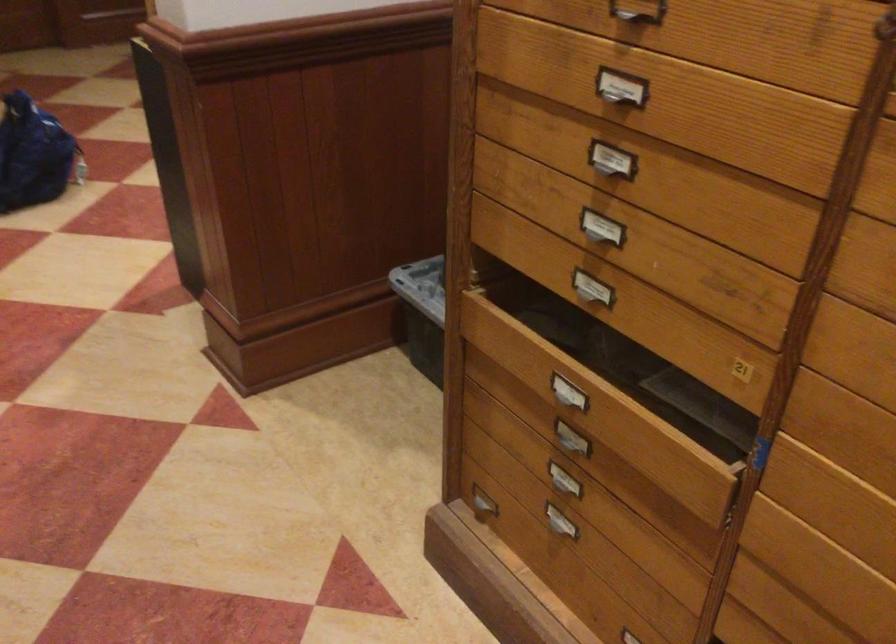
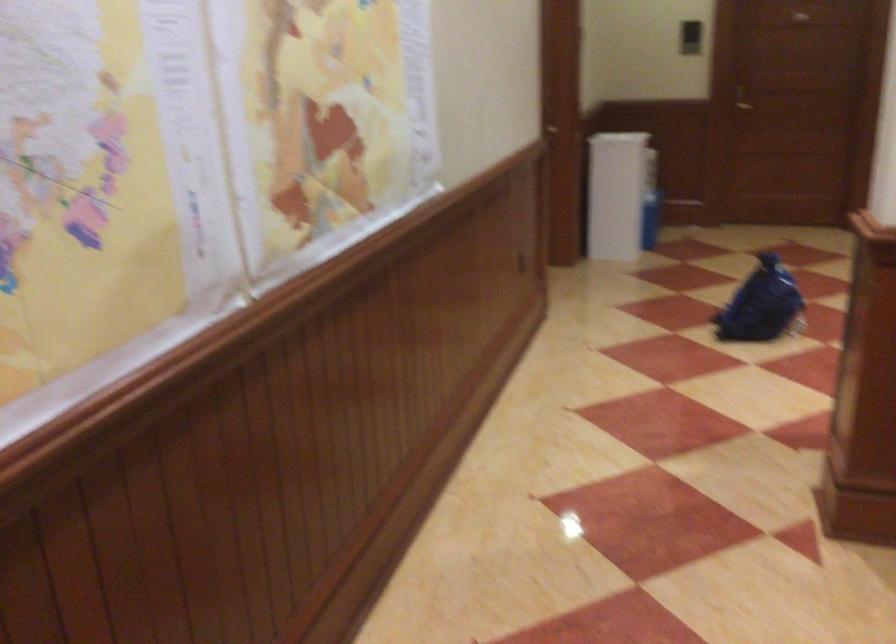
Question: The camera is either moving clockwise (left) or counter-clockwise (right) around the object. The first image is from the beginning of the video and the second image is from the end. Is the camera moving left or right when shooting the video?

Choices:
 (A) Left
 (B) Right

Answer: (B)